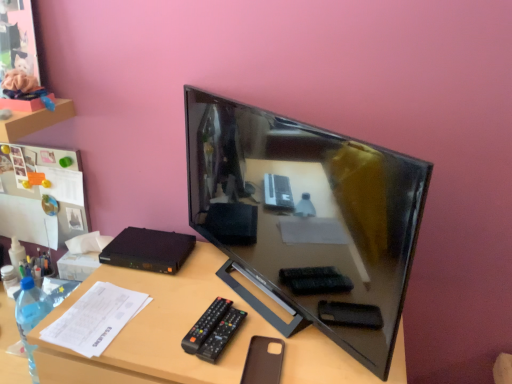
You are a GUI agent. You are given a task and a screenshot of the screen. Output one action in this format:
    pyautogui.click(x=<x>, y=<y>)
    Task: Click on the free space between brown leather phone case at lower center and white paper at lower left
    
    Given the screenshot: What is the action you would take?
    pyautogui.click(x=174, y=337)